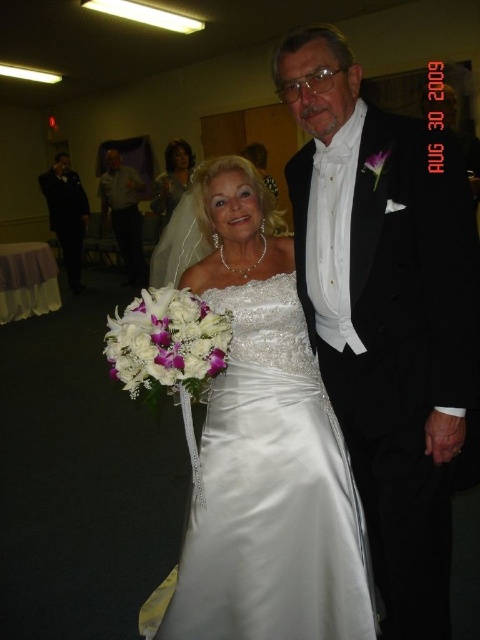
You are a photographer at a wedding reception and need to adjust the lighting to ensure both the black satin tuxedo at center and the satin dress at center are well illuminated. Considering their sizes, which object should you focus on first to ensure proper exposure?

The black satin tuxedo at center has a smaller size compared to the satin dress at center, so you should focus on the smaller black satin tuxedo at center first to ensure its details are properly exposed before adjusting for the larger satin dress at center.

You are a photographer at a wedding reception. You need to arrange the bride in the satin dress at center and the groom in the matte gray shirt at left for a group photo. Based on their current positions, which one is more to the right?

The satin dress at center is positioned on the right side of matte gray shirt at left, so the bride in the satin dress at center is more to the right than the groom in the matte gray shirt at left.

You are a photographer at the wedding reception. You need to ensure that both the black satin tuxedo at center and the satin dress at center are fully visible in the frame. Given that the camera can only capture a certain width, which of the two outfits requires more space to be fully captured?

The satin dress at center requires more space to be fully captured because its width is greater than the black satin tuxedo at center.